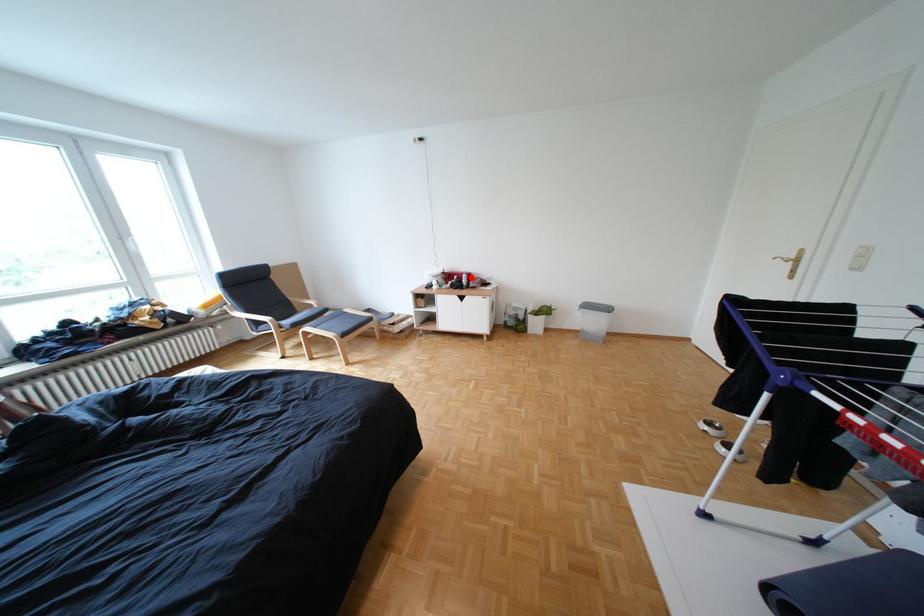
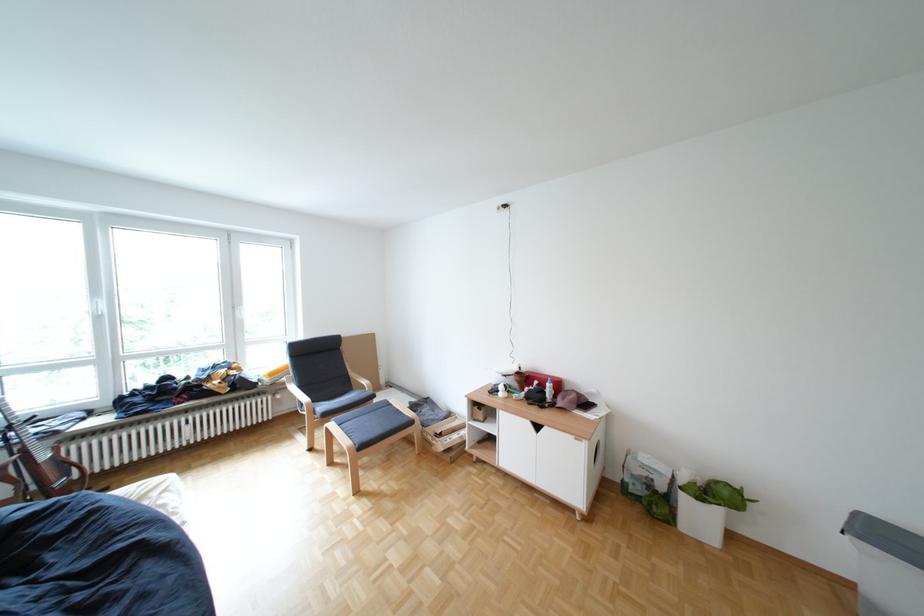
Question: I am providing you with two images of the same scene from different viewpoints. A red point is shown in image1. For the corresponding object point in image2, is it positioned nearer or farther from the camera?

Choices:
 (A) Nearer
 (B) Farther

Answer: (B)